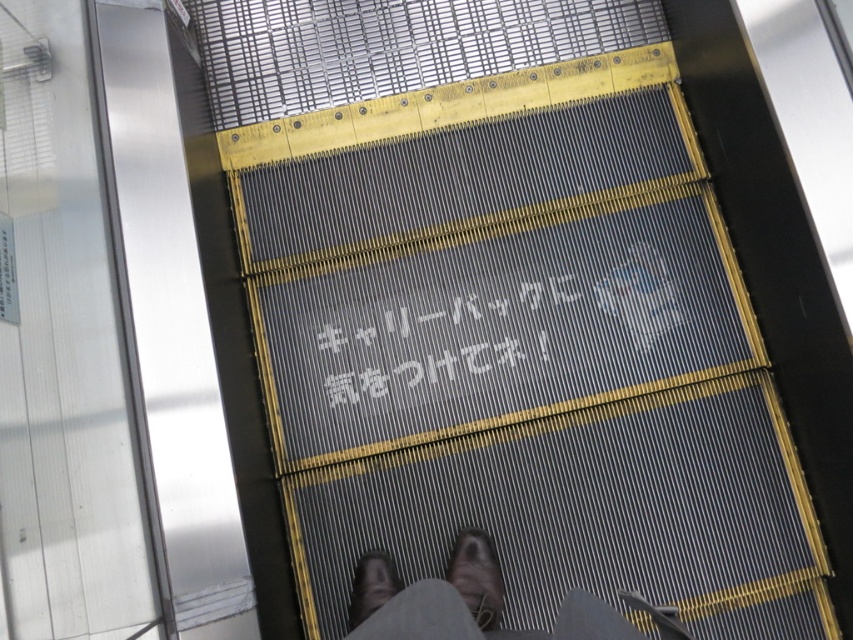
Does dark brown leather shoes at center appear on the right side of dark brown leather shoe at lower center?

Correct, you'll find dark brown leather shoes at center to the right of dark brown leather shoe at lower center.

Between dark brown leather shoes at center and dark brown leather shoe at lower center, which one is positioned higher?

dark brown leather shoes at center is higher up.

Image resolution: width=853 pixels, height=640 pixels. Describe the element at coordinates (463, 602) in the screenshot. I see `dark brown leather shoes at center` at that location.

At what (x,y) coordinates should I click in order to perform the action: click on dark brown leather shoes at center. Please return your answer as a coordinate pair (x, y). Looking at the image, I should click on (463, 602).

Can you confirm if whitematerial/texturewriting at center is positioned to the left of brown leather shoe at center?

Yes, whitematerial/texturewriting at center is to the left of brown leather shoe at center.

Consider the image. Is whitematerial/texturewriting at center below brown leather shoe at center?

No, whitematerial/texturewriting at center is not below brown leather shoe at center.

Is point (381, 384) closer to camera compared to point (495, 566)?

No, it is behind (495, 566).

You are a GUI agent. You are given a task and a screenshot of the screen. Output one action in this format:
    pyautogui.click(x=<x>, y=<y>)
    Task: Click on the whitematerial/texturewriting at center
    This screenshot has width=853, height=640.
    Given the screenshot: What is the action you would take?
    pyautogui.click(x=440, y=340)

Is brown leather shoe at center positioned at the back of dark brown leather shoe at lower center?

No, brown leather shoe at center is in front of dark brown leather shoe at lower center.

Who is positioned more to the left, brown leather shoe at center or dark brown leather shoe at lower center?

From the viewer's perspective, dark brown leather shoe at lower center appears more on the left side.

Who is more distant from viewer, (492, 564) or (376, 560)?

The point (376, 560) is more distant.

Where is `brown leather shoe at center`? brown leather shoe at center is located at coordinates (477, 577).